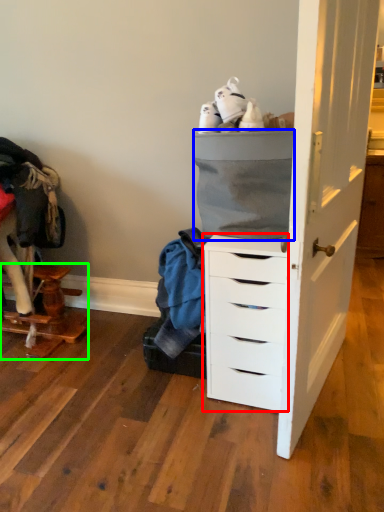
Question: Which is farther away from chest of drawers (highlighted by a red box)? cabinetry (highlighted by a blue box) or furniture (highlighted by a green box)?

Choices:
 (A) cabinetry
 (B) furniture

Answer: (B)